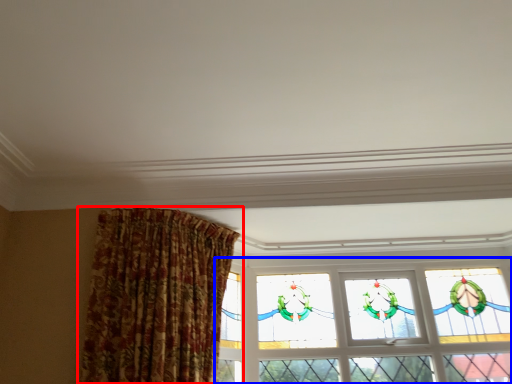
Question: Which of the following is the farthest to the observer, curtain (highlighted by a red box) or window (highlighted by a blue box)?

Choices:
 (A) curtain
 (B) window

Answer: (B)